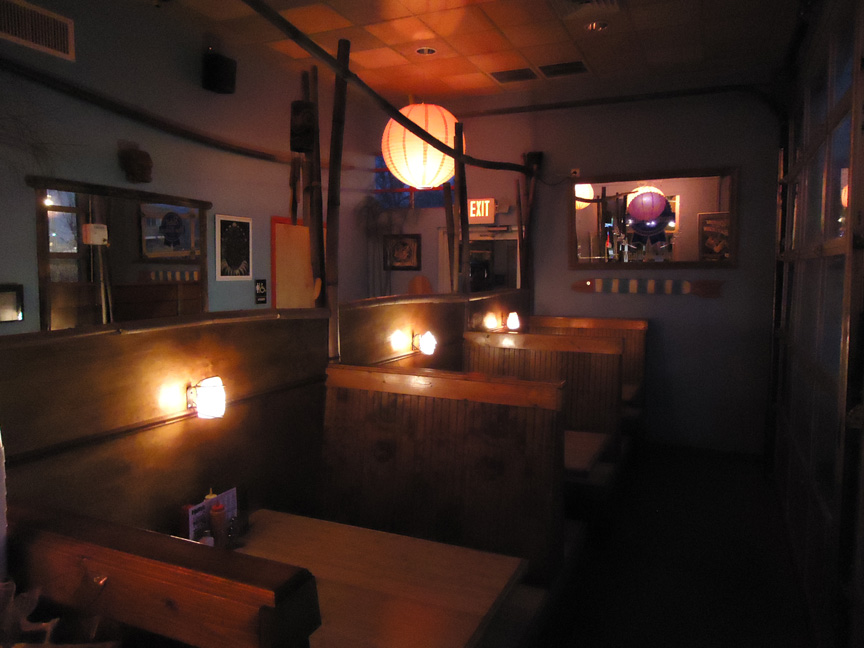
Identify the location of tables. (408, 583), (587, 439), (630, 389).